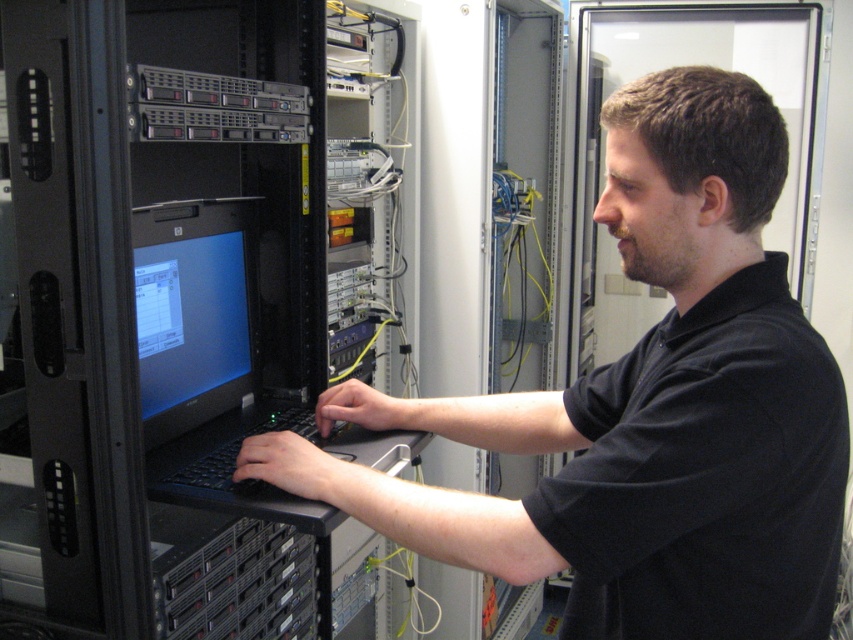
Question: Which is nearer to the black matte computer at center?

Choices:
 (A) black matte laptop at center
 (B) matte black monitor at center-left

Answer: (A)

Question: Which of these objects is positioned closest to the black matte laptop at center?

Choices:
 (A) black matte computer at center
 (B) matte black monitor at center-left

Answer: (B)

Question: Does black matte computer at center have a smaller size compared to black matte laptop at center?

Choices:
 (A) no
 (B) yes

Answer: (A)

Question: Can you confirm if black matte laptop at center is positioned to the right of matte black monitor at center-left?

Choices:
 (A) yes
 (B) no

Answer: (A)

Question: Among these points, which one is nearest to the camera?

Choices:
 (A) (196, 259)
 (B) (643, 396)

Answer: (B)

Question: Does black matte computer at center have a greater width compared to matte black monitor at center-left?

Choices:
 (A) no
 (B) yes

Answer: (B)